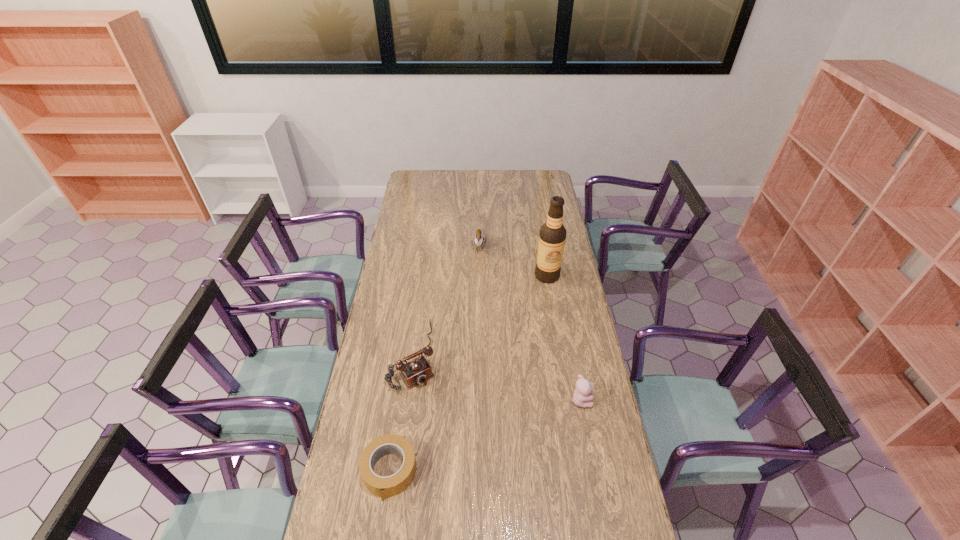
Identify the location of vacant space that is in between the fourth shortest object and the teddy bear. This screenshot has height=540, width=960. (530, 322).

This screenshot has width=960, height=540. Identify the location of free space between the nearest object and the tallest object. tap(468, 374).

The image size is (960, 540). Find the location of `unoccupied area between the nearest object and the alcohol`. unoccupied area between the nearest object and the alcohol is located at coordinates [x=468, y=374].

You are a GUI agent. You are given a task and a screenshot of the screen. Output one action in this format:
    pyautogui.click(x=<x>, y=<y>)
    Task: Click on the free area in between the duct tape and the teddy bear
    
    Given the screenshot: What is the action you would take?
    pyautogui.click(x=486, y=435)

Where is `vacant space in between the tallest object and the farthest object`? Image resolution: width=960 pixels, height=540 pixels. vacant space in between the tallest object and the farthest object is located at coordinates (514, 261).

You are a GUI agent. You are given a task and a screenshot of the screen. Output one action in this format:
    pyautogui.click(x=<x>, y=<y>)
    Task: Click on the empty space between the telephone and the third object from left to right
    The image size is (960, 540).
    Given the screenshot: What is the action you would take?
    pyautogui.click(x=446, y=300)

Where is `object that is the fourth closest to the teddy bear`? This screenshot has width=960, height=540. object that is the fourth closest to the teddy bear is located at coordinates (478, 239).

Identify the location of object that stands as the closest to the teddy bear. The image size is (960, 540). click(x=417, y=371).

The width and height of the screenshot is (960, 540). I want to click on blank space that satisfies the following two spatial constraints: 1. on the back side of the telephone; 2. on the right side of the alcohol, so click(x=424, y=276).

You are a GUI agent. You are given a task and a screenshot of the screen. Output one action in this format:
    pyautogui.click(x=<x>, y=<y>)
    Task: Click on the free space that satisfies the following two spatial constraints: 1. on the front side of the teddy bear; 2. at the face of the alcohol
    
    Given the screenshot: What is the action you would take?
    pyautogui.click(x=567, y=400)